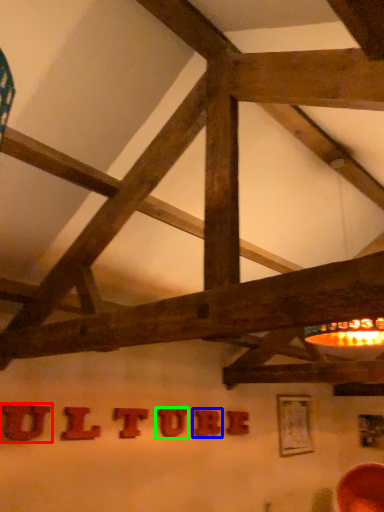
Question: Which object is positioned farthest from letter (highlighted by a red box)? Select from letter (highlighted by a blue box) and letter (highlighted by a green box).

Choices:
 (A) letter
 (B) letter

Answer: (A)